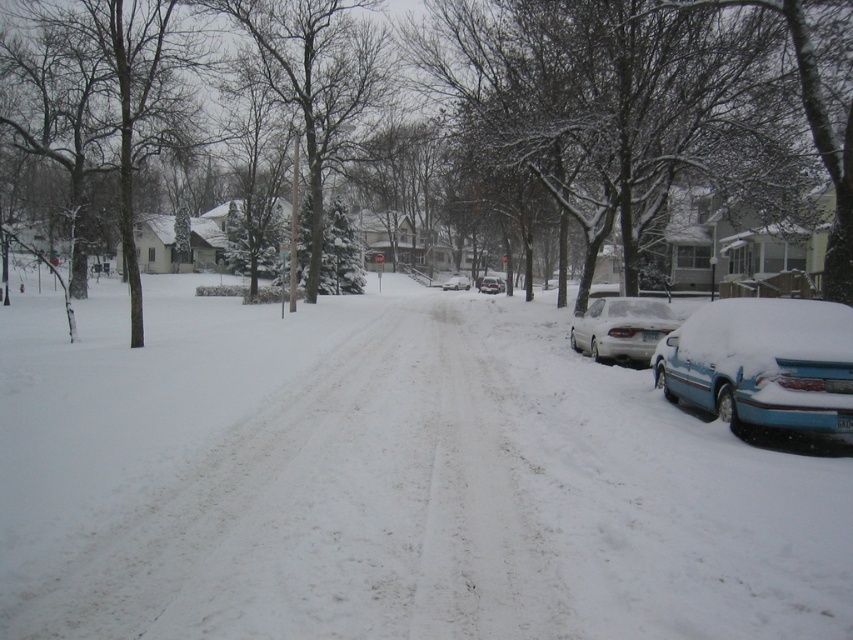
Between point (149, 401) and point (717, 358), which one is positioned behind?

Point (149, 401)

Which of these two, white fluffy snow at center or blue matte car at right, stands taller?

Standing taller between the two is white fluffy snow at center.

This screenshot has width=853, height=640. Identify the location of white fluffy snow at center. (386, 481).

Is blue matte car at right to the left of white matte sedan at right from the viewer's perspective?

Indeed, blue matte car at right is positioned on the left side of white matte sedan at right.

You are a GUI agent. You are given a task and a screenshot of the screen. Output one action in this format:
    pyautogui.click(x=<x>, y=<y>)
    Task: Click on the blue matte car at right
    The height and width of the screenshot is (640, 853).
    Given the screenshot: What is the action you would take?
    pyautogui.click(x=762, y=364)

This screenshot has height=640, width=853. I want to click on blue matte car at right, so click(x=762, y=364).

Is point (738, 420) positioned in front of point (466, 284)?

Yes.

Does blue matte car at right appear over white matte sedan at center?

Incorrect, blue matte car at right is not positioned above white matte sedan at center.

Locate an element on the screen. The image size is (853, 640). blue matte car at right is located at coordinates (762, 364).

What are the coordinates of `blue matte car at right` in the screenshot? It's located at (762, 364).